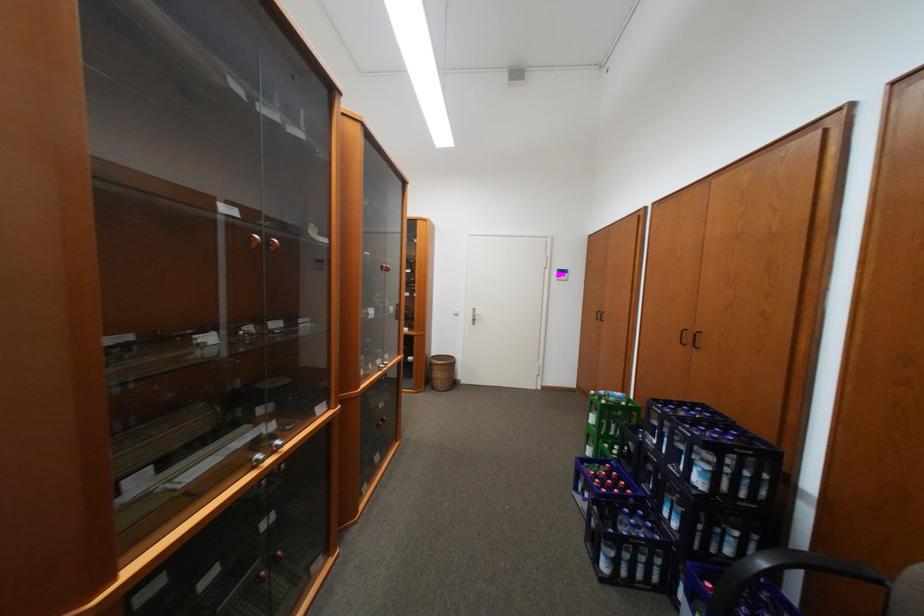
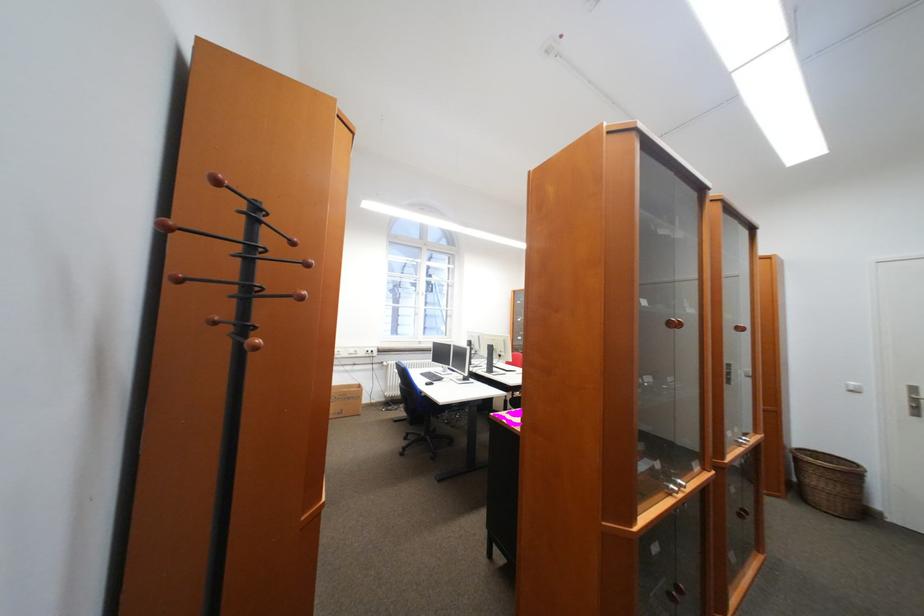
Locate, in the second image, the point that corresponds to (x=286, y=443) in the first image.

(689, 482)